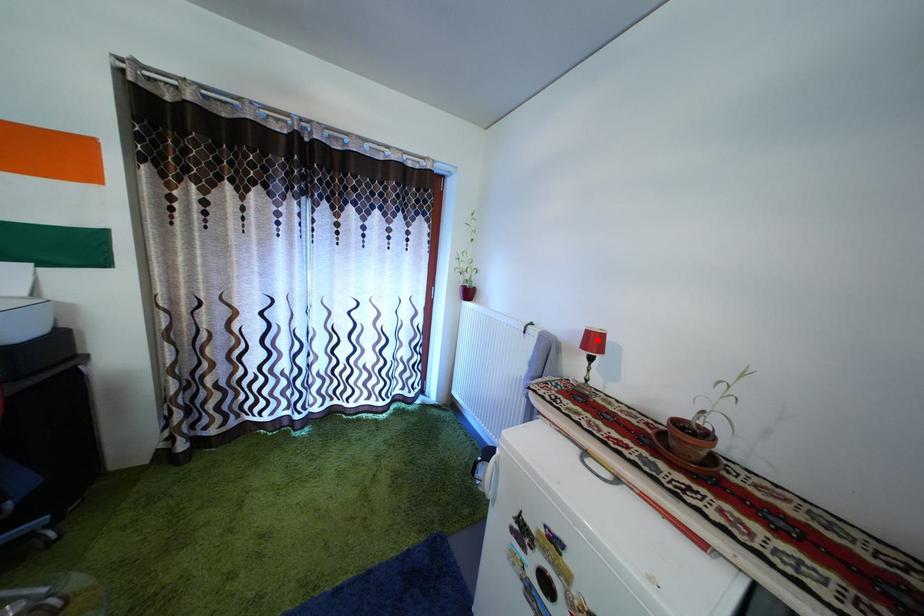
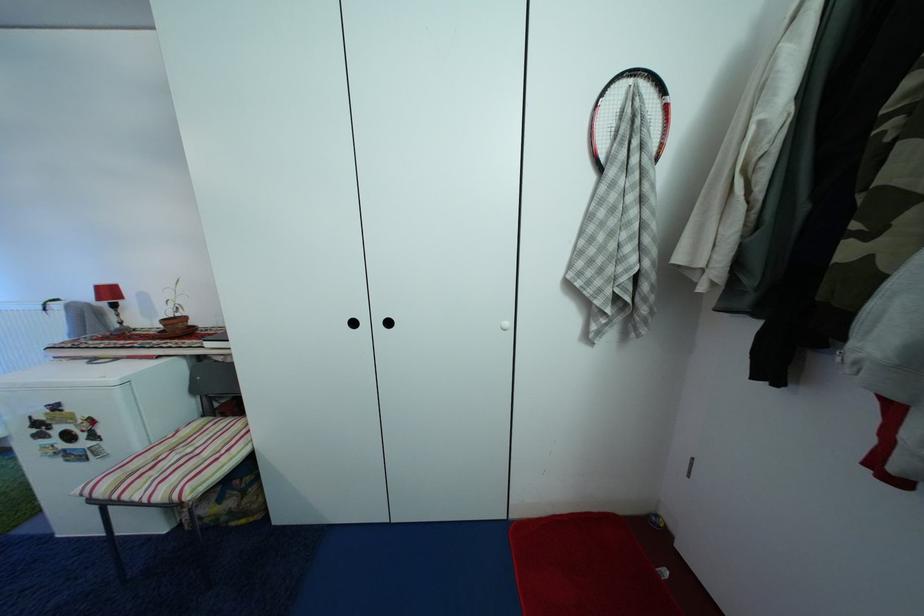
Locate, in the second image, the point that corresponds to the highlighted location in the first image.

(106, 294)